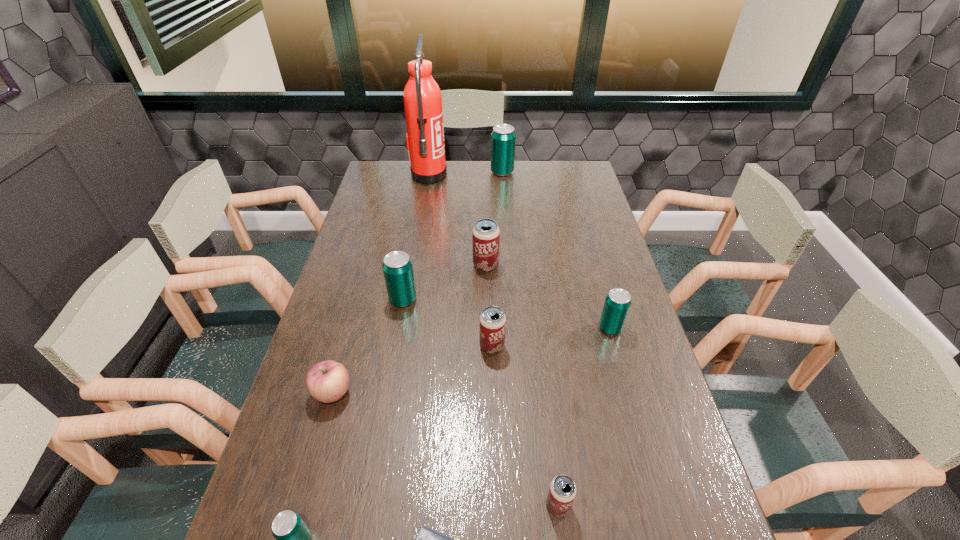
Where is `vacant region between the tallest object and the second smallest red beer can`? vacant region between the tallest object and the second smallest red beer can is located at coordinates (461, 261).

Identify the location of free space that is in between the sixth nearest beer can and the apple. (409, 329).

At what (x,y) coordinates should I click in order to perform the action: click on empty space that is in between the biggest teal beer can and the sixth nearest beer can. Please return your answer as a coordinate pair (x, y). This screenshot has height=540, width=960. Looking at the image, I should click on coord(494,219).

Image resolution: width=960 pixels, height=540 pixels. I want to click on vacant area between the tallest object and the third farthest teal beer can, so click(519, 252).

Identify the location of empty space between the biggest teal beer can and the seventh nearest object. (452, 236).

Where is `the seventh closest object to the second biggest red beer can`? the seventh closest object to the second biggest red beer can is located at coordinates (293, 538).

Where is `the sixth closest object to the second biggest red beer can`? This screenshot has width=960, height=540. the sixth closest object to the second biggest red beer can is located at coordinates (426, 539).

Image resolution: width=960 pixels, height=540 pixels. In order to click on the third closest beer can relative to the third teal beer can from right to left in this screenshot , I will do `click(617, 303)`.

Identify which beer can is the closest to the rightmost object. Please provide its 2D coordinates. Your answer should be formatted as a tuple, i.e. [(x, y)], where the tuple contains the x and y coordinates of a point satisfying the conditions above.

[(492, 320)]

Where is `the closest teal beer can to the rightmost teal beer can`? This screenshot has width=960, height=540. the closest teal beer can to the rightmost teal beer can is located at coordinates (397, 267).